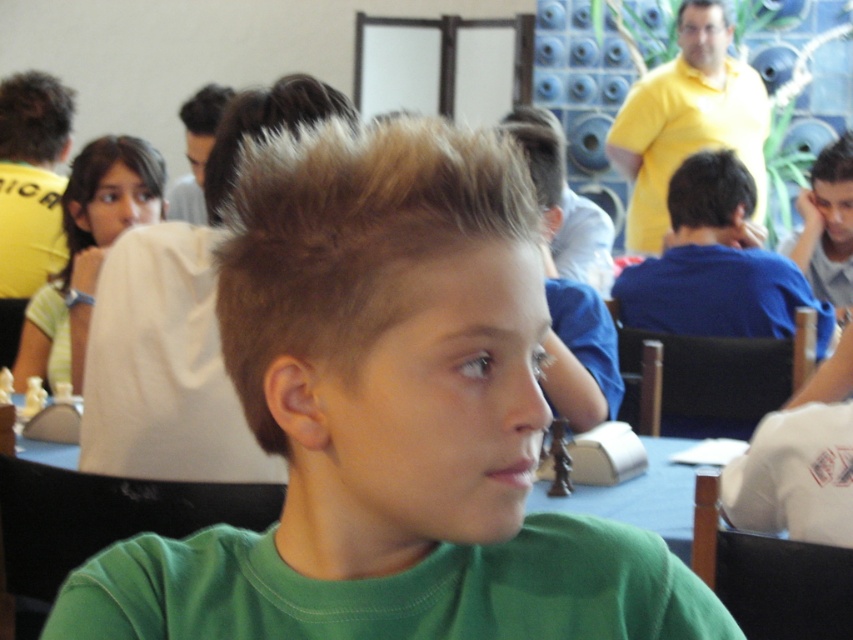
Question: Is light brown hair at upper left positioned behind slicked-back hair at center?

Choices:
 (A) no
 (B) yes

Answer: (A)

Question: Which object is positioned closest to the green matte shirt at center?

Choices:
 (A) light brown hair at upper left
 (B) dark brown hair at upper left

Answer: (A)

Question: Which point is farther from the camera taking this photo?

Choices:
 (A) (96, 170)
 (B) (822, 173)

Answer: (B)

Question: Where is slicked-back hair at center located in relation to dark brown hair at upper left in the image?

Choices:
 (A) below
 (B) above

Answer: (A)

Question: Which point is farther to the camera?

Choices:
 (A) slicked brown hair at upper right
 (B) light brown hair at upper left

Answer: (A)

Question: Considering the relative positions of green matte shirt at center and slicked brown hair at upper right in the image provided, where is green matte shirt at center located with respect to slicked brown hair at upper right?

Choices:
 (A) below
 (B) above

Answer: (A)